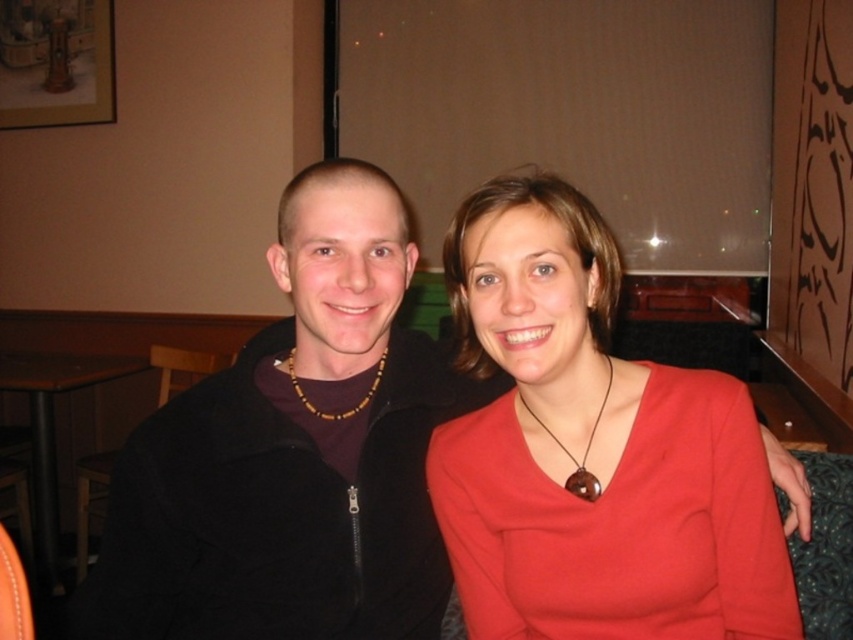
You are designing a necklace organizer and need to know which object is taller between the brown wood pendant at center and the brown wooden beads at center. Which one is taller?

The brown wood pendant at center is taller than the brown wooden beads at center.

Based on the photo, in the image, there are a black matte jacket at left and brown wooden beads at center. Which object is positioned to the left of the other?

The black matte jacket at left is to the left of brown wooden beads at center.

You are a photographer trying to capture a closeup of the brown wood pendant at center. You are currently standing in front of the brown wooden table at lower left. Can you move forward to get a better shot without moving the table?

The brown wooden table at lower left is further to the viewer than brown wood pendant at center, so you cannot move forward to get a better shot without moving the table because the pendant is behind the table.